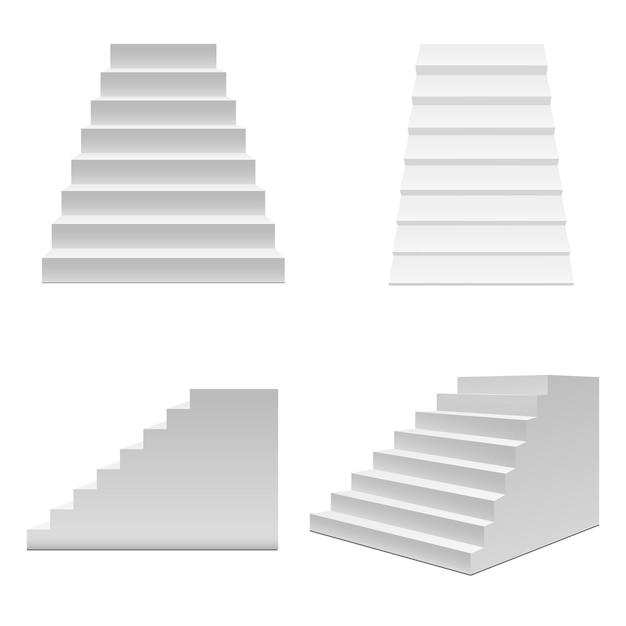
Locate an element on the screen. step on upper left staircase is located at coordinates (x=173, y=257), (x=168, y=222), (x=165, y=190), (x=166, y=158), (x=163, y=126), (x=160, y=101), (x=160, y=73), (x=160, y=44).